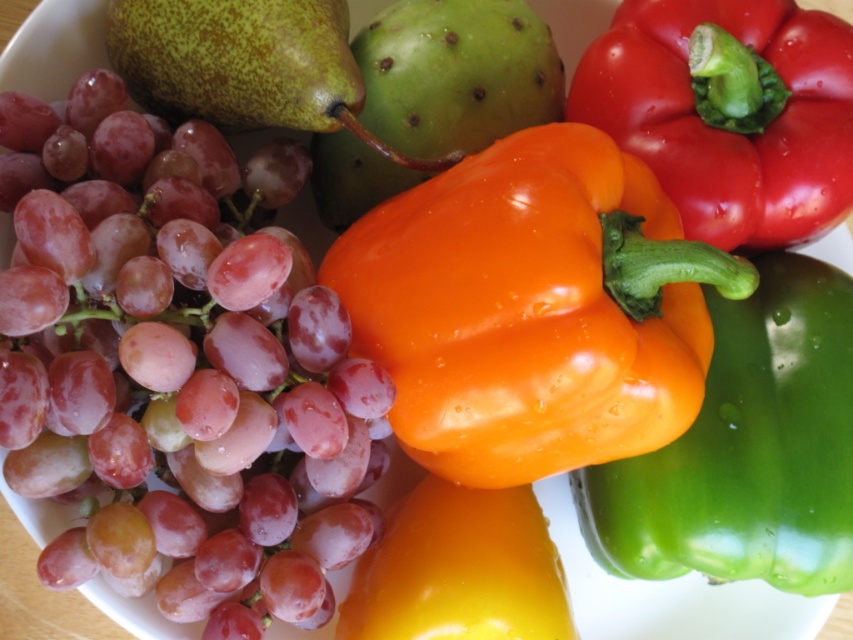
Image resolution: width=853 pixels, height=640 pixels. In order to click on shiny orange bell pepper at center in this screenshot , I will do `click(532, 308)`.

Between shiny orange bell pepper at center and green glossy bell pepper at center, which one has more height?

green glossy bell pepper at center

What do you see at coordinates (532, 308) in the screenshot? The image size is (853, 640). I see `shiny orange bell pepper at center` at bounding box center [532, 308].

This screenshot has height=640, width=853. I want to click on shiny orange bell pepper at center, so [x=532, y=308].

Where is `glossy red grapes at left`? glossy red grapes at left is located at coordinates (177, 365).

Between point (30, 336) and point (659, 218), which one is positioned in front?

Positioned in front is point (30, 336).

Locate an element on the screen. Image resolution: width=853 pixels, height=640 pixels. glossy red grapes at left is located at coordinates (177, 365).

Between shiny orange bell pepper at center and shiny red bell pepper at upper right, which one is positioned higher?

shiny red bell pepper at upper right is higher up.

Is shiny orange bell pepper at center smaller than shiny red bell pepper at upper right?

Incorrect, shiny orange bell pepper at center is not smaller in size than shiny red bell pepper at upper right.

Where is `shiny orange bell pepper at center`? shiny orange bell pepper at center is located at coordinates (532, 308).